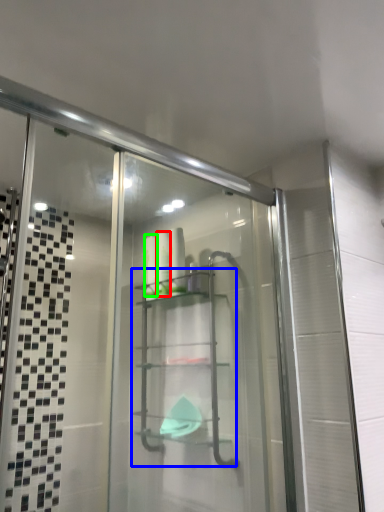
Question: Which is farther away from toiletry (highlighted by a red box)? glass box (highlighted by a blue box) or toiletry (highlighted by a green box)?

Choices:
 (A) glass box
 (B) toiletry

Answer: (A)